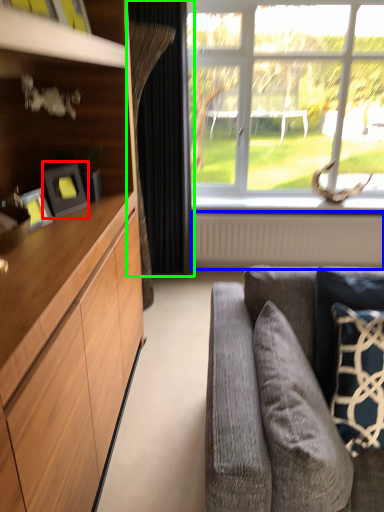
Question: Considering the real-world distances, which object is closest to picture frame (highlighted by a red box)? radiator (highlighted by a blue box) or curtain (highlighted by a green box).

Choices:
 (A) radiator
 (B) curtain

Answer: (B)